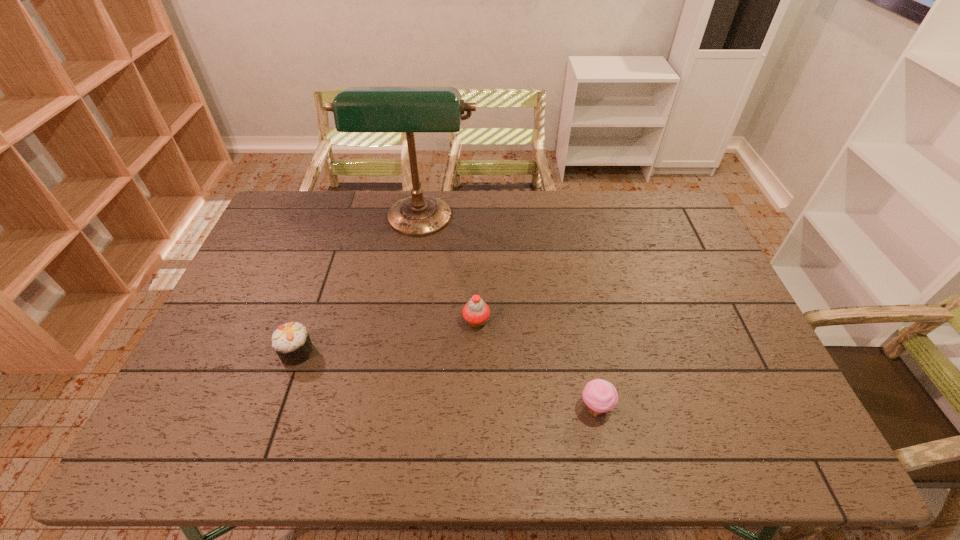
The height and width of the screenshot is (540, 960). I want to click on vacant area that lies between the farthest cupcake and the rightmost object, so click(536, 364).

The image size is (960, 540). In order to click on blank region between the rightmost cupcake and the leftmost cupcake in this screenshot , I will do (446, 380).

Locate an element on the screen. The height and width of the screenshot is (540, 960). vacant area that lies between the second farthest object and the rightmost object is located at coordinates (536, 364).

I want to click on free space between the second farthest object and the third farthest object, so click(x=387, y=336).

Find the location of a particular element. free point between the nearest object and the leftmost cupcake is located at coordinates (446, 380).

Identify the location of vacant area between the leftmost object and the second farthest object. (387, 336).

The image size is (960, 540). Identify the location of empty space that is in between the farthest cupcake and the table lamp. (447, 272).

At what (x,y) coordinates should I click in order to perform the action: click on free space between the nearest object and the leftmost object. Please return your answer as a coordinate pair (x, y). The height and width of the screenshot is (540, 960). Looking at the image, I should click on (446, 380).

Where is `free area in between the farthest cupcake and the nearest cupcake`? The height and width of the screenshot is (540, 960). free area in between the farthest cupcake and the nearest cupcake is located at coordinates (536, 364).

Where is `object that can be found as the third closest to the rightmost object`? This screenshot has height=540, width=960. object that can be found as the third closest to the rightmost object is located at coordinates pyautogui.click(x=291, y=341).